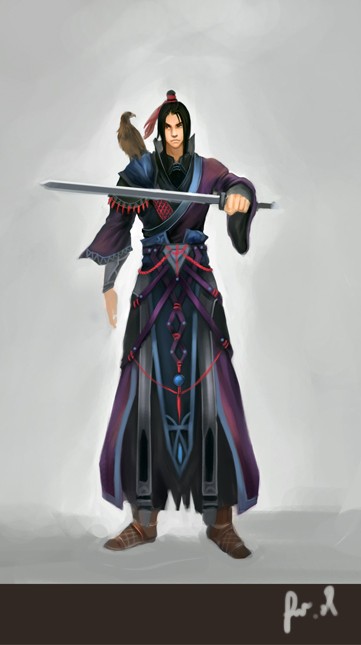
You are a GUI agent. You are given a task and a screenshot of the screen. Output one action in this format:
    pyautogui.click(x=<x>, y=<y>)
    Task: Click on the wall
    The height and width of the screenshot is (645, 361).
    Given the screenshot: What is the action you would take?
    pyautogui.click(x=309, y=59)